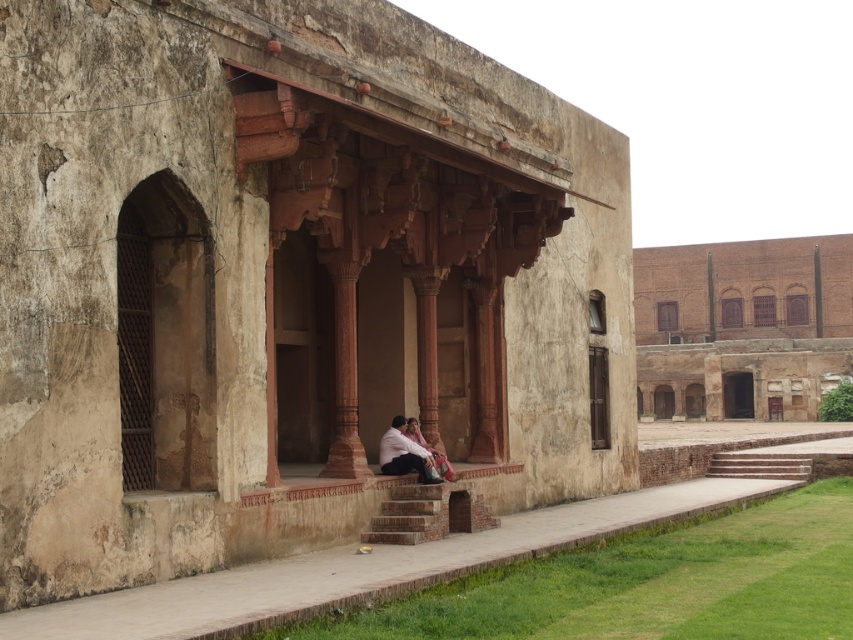
You are standing in front of the old building and want to determine the relative positions of two points marked on the porch. Which point is closer to you, point (218, 140) or point (432, 506)?

Point (218, 140) is closer to the viewer than point (432, 506).

You are standing on the brown stone stairs at center and want to enter the brown stone palace at center. In which direction should you move to reach the palace?

You should move to the right to reach the brown stone palace at center because it is located to the left of the brown stone stairs at center, so moving right from the stairs will lead you towards the palace.